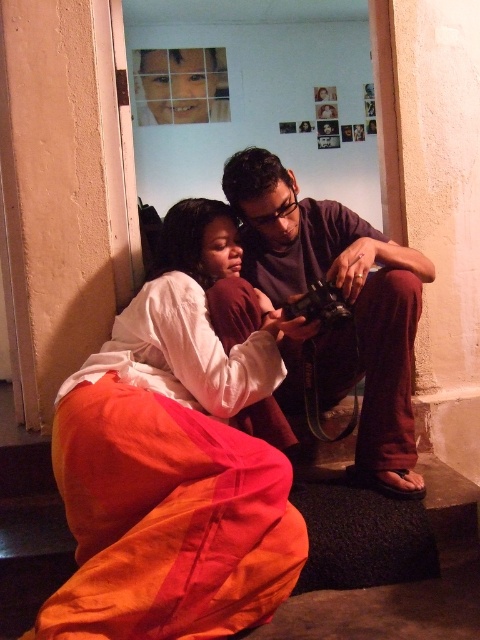
Does orange cotton pants at lower left have a smaller size compared to dark purple shirt at center?

Actually, orange cotton pants at lower left might be larger than dark purple shirt at center.

Is point (74, 492) positioned before point (328, 260)?

Yes, point (74, 492) is in front of point (328, 260).

You are a GUI agent. You are given a task and a screenshot of the screen. Output one action in this format:
    pyautogui.click(x=<x>, y=<y>)
    Task: Click on the orange cotton pants at lower left
    The width and height of the screenshot is (480, 640).
    Given the screenshot: What is the action you would take?
    pyautogui.click(x=173, y=461)